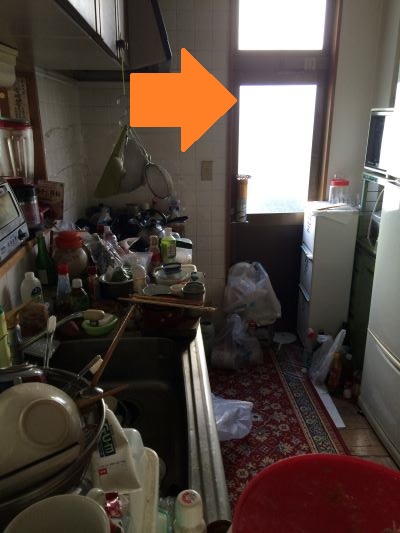
Where is `door`? The image size is (400, 533). door is located at coordinates (256, 244).